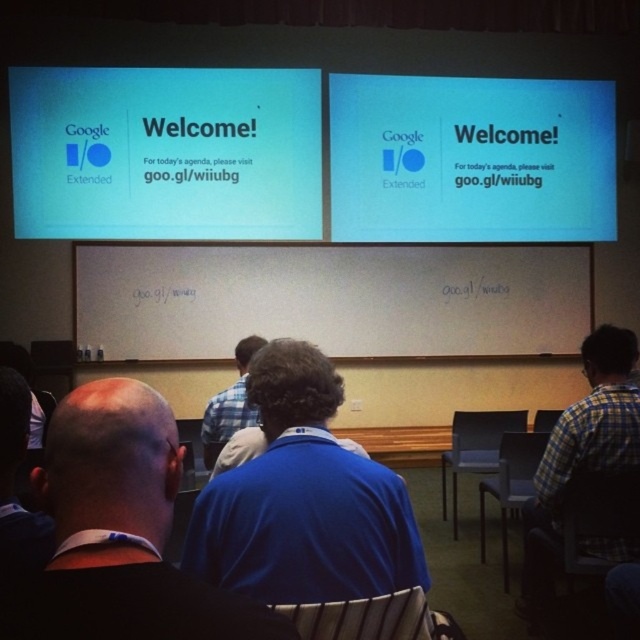
Is black fabric shirt at center closer to the viewer compared to wooden slats chair at center?

Yes.

Which is more to the right, black fabric shirt at center or wooden slats chair at center?

From the viewer's perspective, wooden slats chair at center appears more on the right side.

Is point (150, 515) more distant than point (385, 609)?

No, (150, 515) is closer to viewer.

You are a GUI agent. You are given a task and a screenshot of the screen. Output one action in this format:
    pyautogui.click(x=<x>, y=<y>)
    Task: Click on the black fabric shirt at center
    The image size is (640, 640).
    Given the screenshot: What is the action you would take?
    pyautogui.click(x=120, y=531)

How much distance is there between black fabric shirt at center and gray fabric chair at right?

3.76 meters

Can you confirm if black fabric shirt at center is shorter than gray fabric chair at right?

No.

Does point (116, 420) come farther from viewer compared to point (540, 410)?

No.

This screenshot has height=640, width=640. Find the location of `black fabric shirt at center`. black fabric shirt at center is located at coordinates (120, 531).

From the picture: Between white glossy projector screen at upper center and gray fabric chair at right, which one appears on the left side from the viewer's perspective?

gray fabric chair at right is more to the left.

The height and width of the screenshot is (640, 640). I want to click on white glossy projector screen at upper center, so click(x=470, y=160).

Where is `white glossy projector screen at upper center`? This screenshot has height=640, width=640. white glossy projector screen at upper center is located at coordinates (470, 160).

This screenshot has height=640, width=640. I want to click on white glossy projector screen at upper center, so click(x=470, y=160).